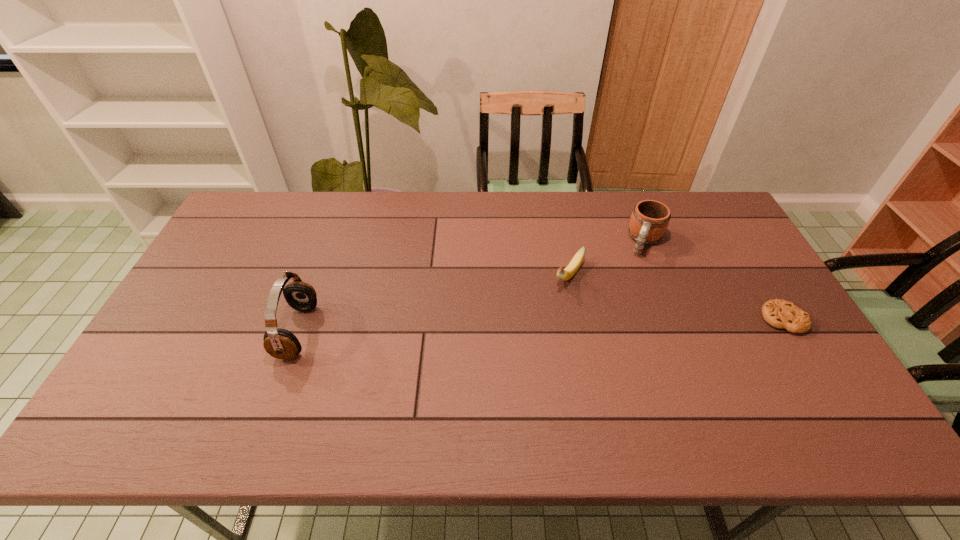
The width and height of the screenshot is (960, 540). What are the coordinates of `the leftmost object` in the screenshot? It's located at (282, 344).

You are a GUI agent. You are given a task and a screenshot of the screen. Output one action in this format:
    pyautogui.click(x=<x>, y=<y>)
    Task: Click on the tallest object
    The height and width of the screenshot is (540, 960).
    Given the screenshot: What is the action you would take?
    pyautogui.click(x=282, y=344)

You are a GUI agent. You are given a task and a screenshot of the screen. Output one action in this format:
    pyautogui.click(x=<x>, y=<y>)
    Task: Click on the cookie
    The image size is (960, 540).
    Given the screenshot: What is the action you would take?
    pyautogui.click(x=781, y=314)

The width and height of the screenshot is (960, 540). What are the coordinates of `the shortest object` in the screenshot? It's located at (781, 314).

I want to click on the third object from left to right, so click(649, 220).

In order to click on the third shortest object in this screenshot , I will do `click(649, 220)`.

At what (x,y) coordinates should I click in order to perform the action: click on the third tallest object. Please return your answer as a coordinate pair (x, y). Looking at the image, I should click on (565, 274).

Locate an element on the screen. Image resolution: width=960 pixels, height=540 pixels. the third object from right to left is located at coordinates (565, 274).

Find the location of a particular element. free region located on the ear cups of the leftmost object is located at coordinates (458, 332).

This screenshot has height=540, width=960. In order to click on vacant space situated 0.400m on the left of the cookie in this screenshot , I will do `click(617, 319)`.